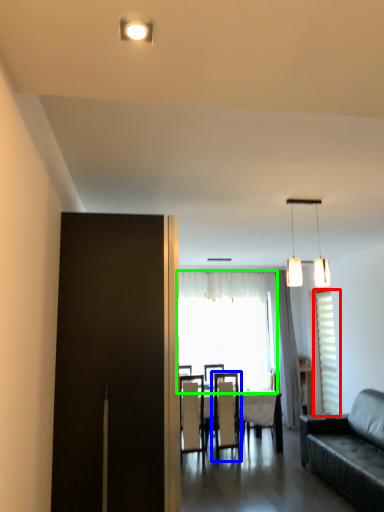
Question: Which is farther away from window (highlighted by a red box)? chair (highlighted by a blue box) or window (highlighted by a green box)?

Choices:
 (A) chair
 (B) window

Answer: (B)